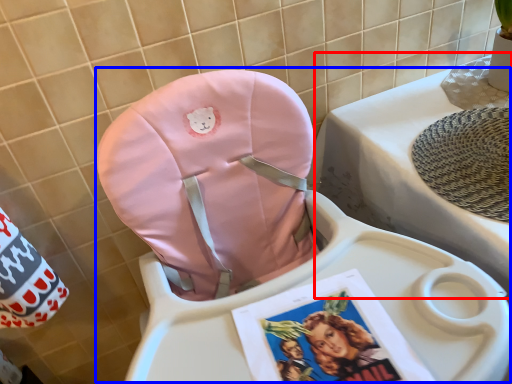
Question: Which point is closer to the camera, changing table (highlighted by a red box) or baby carriage (highlighted by a blue box)?

Choices:
 (A) changing table
 (B) baby carriage

Answer: (B)